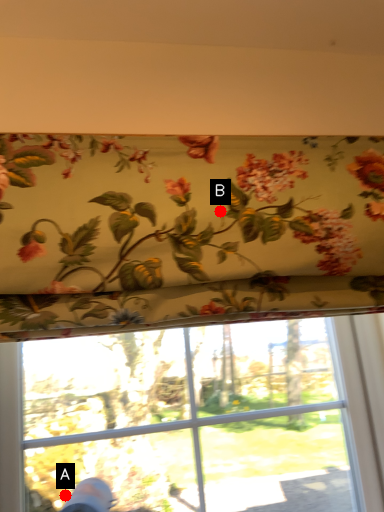
Question: Two points are circled on the image, labeled by A and B beside each circle. Which point is closer to the camera?

Choices:
 (A) A is closer
 (B) B is closer

Answer: (B)